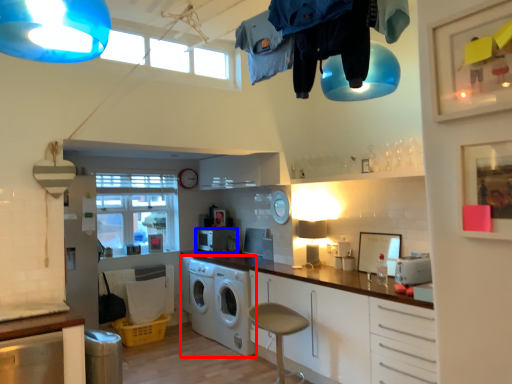
Question: Which object appears closest to the camera in this image, washing machine (highlighted by a red box) or appliance (highlighted by a blue box)?

Choices:
 (A) washing machine
 (B) appliance

Answer: (A)